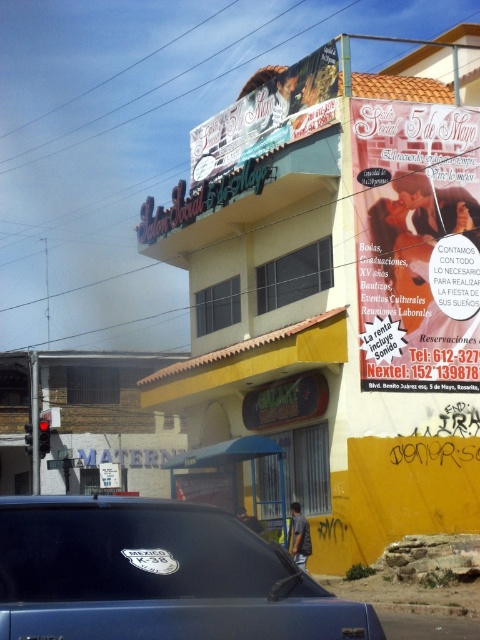
You are a customer looking for the contact information of Sal?n Social 5 de Mayo. You see the matte pink sign at upper right and the matte plastic signboard at upper center. Which sign contains the phone numbers?

The matte plastic signboard at upper center contains the phone numbers because it is larger than the matte pink sign at upper right.

You are a delivery driver who needs to read the license plate at lower center to confirm the address. However, the signboard at upper center is blocking your view. Can you estimate whether the white plastic license plate at lower center is fully visible despite the matte plastic signboard at upper center possibly being wider?

The matte plastic signboard at upper center might be wider than the white plastic license plate at lower center, so there is a possibility that part of the white plastic license plate at lower center is blocked by the wider matte plastic signboard at upper center.